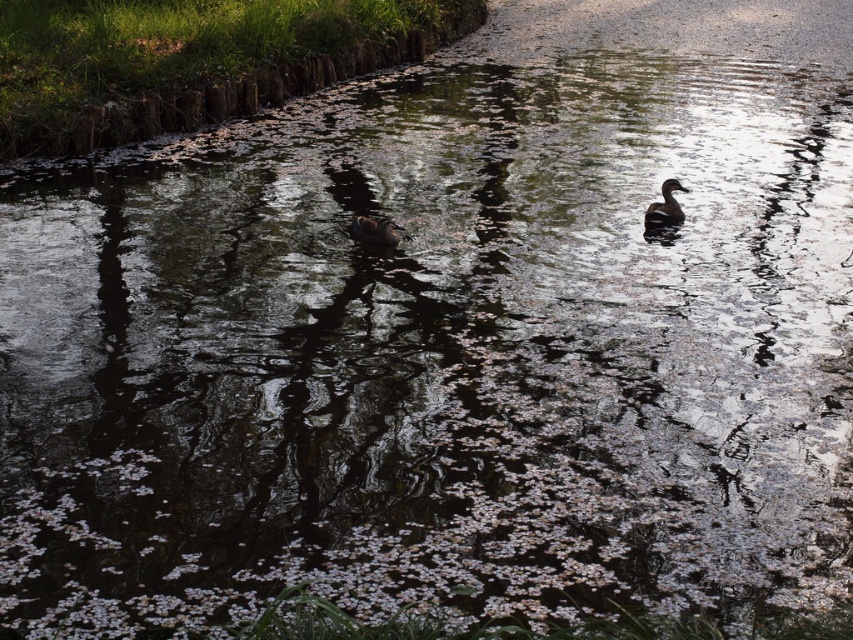
You are an ornithologist observing the scene. You notice two dark brown objects at the center of the water. One is labeled as dark brown feathers at center and the other is dark brown glossy duck at center. Which object is smaller in size?

The dark brown feathers at center is smaller in size compared to the dark brown glossy duck at center.

You are an ornithologist observing the scene. You notice two objects in the water at the center. Which one is lower in height between the dark brown feathers at center and the dark brown glossy duck at center?

The dark brown feathers at center has a lesser height compared to the dark brown glossy duck at center, so the dark brown feathers at center is lower in height.